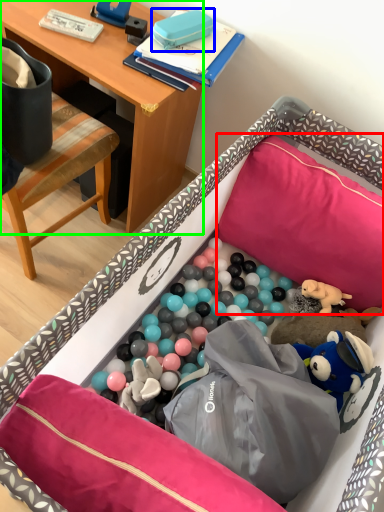
Question: Estimate the real-world distances between objects in this image. Which object is closer to pillow (highlighted by a red box), toy (highlighted by a blue box) or desk (highlighted by a green box)?

Choices:
 (A) toy
 (B) desk

Answer: (B)